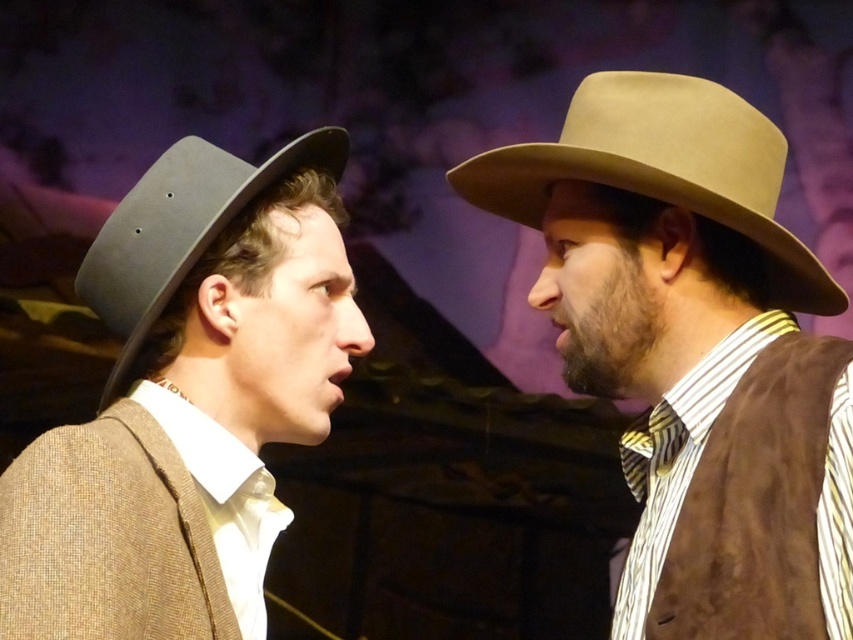
You are a stagehand standing 1.5 meters away from the beige felt hat at center. Can you reach it without moving closer?

The beige felt hat at center is 1.10 meters away from the viewer. Since you are standing 1.5 meters away, you are farther than the hat, so you cannot reach it without moving closer.

Based on the photo, you are a costume designer preparing for a play. You need to choose between the matte black hat at left and the matte black fedora at left for an actor who needs a headpiece that stands out visually. Which one would you select based on their height?

The matte black hat at left is much taller than the matte black fedora at left, so it would stand out more visually.